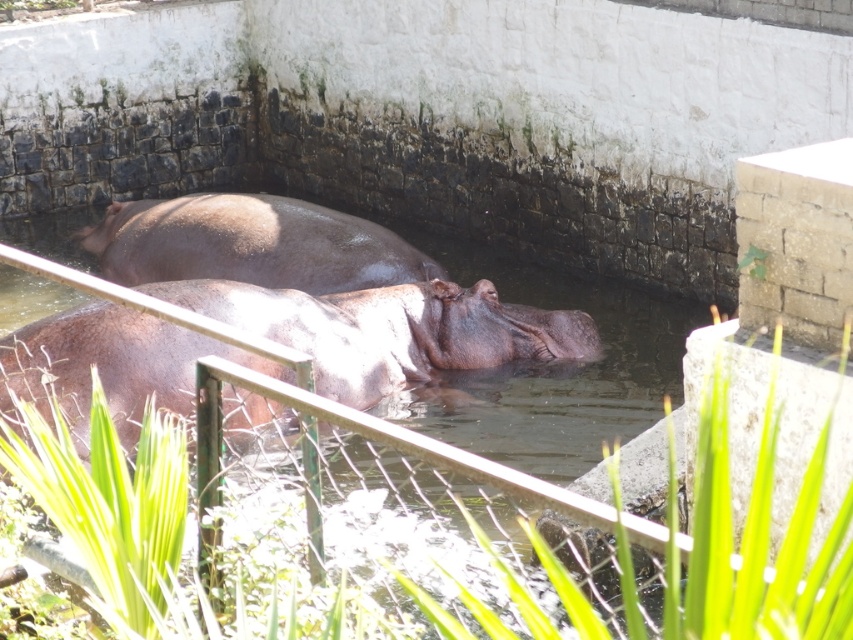
Question: Estimate the real-world distances between objects in this image. Which object is farther from the brown matte hippo at center?

Choices:
 (A) shiny brown hippo at upper center
 (B) brown matte water at center

Answer: (B)

Question: Observing the image, what is the correct spatial positioning of brown matte hippo at center in reference to shiny brown hippo at upper center?

Choices:
 (A) left
 (B) right

Answer: (B)

Question: Where is brown matte water at center located in relation to shiny brown hippo at upper center in the image?

Choices:
 (A) left
 (B) right

Answer: (B)

Question: Which point appears closest to the camera in this image?

Choices:
 (A) (161, 246)
 (B) (643, 337)

Answer: (A)

Question: Where is brown matte water at center located in relation to shiny brown hippo at upper center in the image?

Choices:
 (A) above
 (B) below

Answer: (B)

Question: Which of the following is the farthest from the observer?

Choices:
 (A) brown matte water at center
 (B) brown matte hippo at center

Answer: (A)